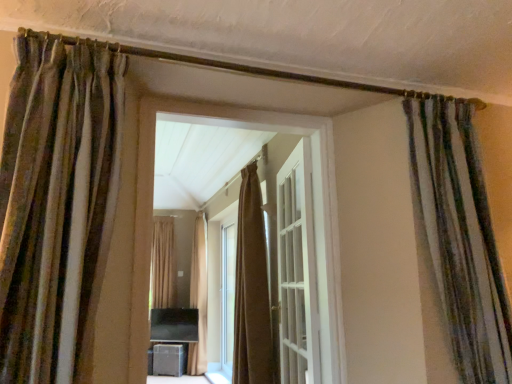
The image size is (512, 384). Describe the element at coordinates (56, 205) in the screenshot. I see `brown textured curtain at left, the fifth curtain positioned from the back` at that location.

Measure the distance between beige fabric curtain at center, which is counted as the 2th curtain, starting from the back, and camera.

The distance of beige fabric curtain at center, which is counted as the 2th curtain, starting from the back, from camera is 5.66 meters.

Where is `brown curtain at center`? Image resolution: width=512 pixels, height=384 pixels. brown curtain at center is located at coordinates (315, 208).

The image size is (512, 384). Describe the element at coordinates (315, 208) in the screenshot. I see `brown curtain at center` at that location.

The image size is (512, 384). I want to click on brown textured curtain at left, which is the third curtain in right-to-left order, so click(x=56, y=205).

Consider the image. Considering the relative sizes of brown textured curtain at center, which appears as the first curtain when viewed from the back, and brown textured curtain at left, the fifth curtain positioned from the back, in the image provided, is brown textured curtain at center, which appears as the first curtain when viewed from the back, shorter than brown textured curtain at left, the fifth curtain positioned from the back,?

No.

From the image's perspective, between brown textured curtain at center, marked as the first curtain in a left-to-right arrangement, and brown textured curtain at left, acting as the 3th curtain starting from the left, who is located below?

brown textured curtain at center, marked as the first curtain in a left-to-right arrangement, appears lower in the image.

Could you measure the distance between brown textured curtain at center, placed as the fifth curtain when sorted from front to back, and brown textured curtain at left, which is the third curtain in right-to-left order?

brown textured curtain at center, placed as the fifth curtain when sorted from front to back, is 5.22 meters from brown textured curtain at left, which is the third curtain in right-to-left order.

Is brown textured curtain at left, the fifth curtain positioned from the back, at the back of brown textured curtain at center, which appears as the first curtain when viewed from the back?

That's not correct — brown textured curtain at center, which appears as the first curtain when viewed from the back, is not looking away from brown textured curtain at left, the fifth curtain positioned from the back.

Considering the sizes of objects striped fabric curtain at right, the 4th curtain when ordered from back to front, and brown textured curtain at left, which is the third curtain in right-to-left order, in the image provided, who is wider, striped fabric curtain at right, the 4th curtain when ordered from back to front, or brown textured curtain at left, which is the third curtain in right-to-left order,?

brown textured curtain at left, which is the third curtain in right-to-left order, is wider.

Could brown textured curtain at left, which is the third curtain in right-to-left order, be considered to be inside striped fabric curtain at right, the 4th curtain when ordered from back to front?

No.

Looking at this image, how many degrees apart are the facing directions of striped fabric curtain at right, the 4th curtain when ordered from back to front, and brown textured curtain at left, acting as the 3th curtain starting from the left?

0 degrees separate the facing orientations of striped fabric curtain at right, the 4th curtain when ordered from back to front, and brown textured curtain at left, acting as the 3th curtain starting from the left.

From their relative heights in the image, would you say striped fabric curtain at right, the 4th curtain when ordered from back to front, is taller or shorter than brown textured curtain at left, which is the third curtain in right-to-left order?

In the image, striped fabric curtain at right, the 4th curtain when ordered from back to front, appears to be taller than brown textured curtain at left, which is the third curtain in right-to-left order.

From a real-world perspective, is white glossy door at center physically located above or below brown textured curtain at left, which is the third curtain in right-to-left order?

Clearly, from a real-world perspective, white glossy door at center is below brown textured curtain at left, which is the third curtain in right-to-left order.

Between white glossy door at center and brown textured curtain at left, the fifth curtain positioned from the back, which one has larger size?

white glossy door at center.

Is white glossy door at center not close to brown textured curtain at left, the fifth curtain positioned from the back?

white glossy door at center is positioned a significant distance from brown textured curtain at left, the fifth curtain positioned from the back.

Can you confirm if white glossy door at center is thinner than beige fabric curtain at center, which is counted as the 2th curtain, starting from the back?

Indeed, white glossy door at center has a lesser width compared to beige fabric curtain at center, which is counted as the 2th curtain, starting from the back.

Which object is closer to the camera taking this photo, white glossy door at center or beige fabric curtain at center, which ranks as the second curtain in left-to-right order?

white glossy door at center is closer to the camera.

Would you say white glossy door at center contains beige fabric curtain at center, which is counted as the 4th curtain, starting from the right?

No, beige fabric curtain at center, which is counted as the 4th curtain, starting from the right, is not inside white glossy door at center.

Is white glossy door at center beside beige fabric curtain at center, the 4th curtain from the front?

No, white glossy door at center is not with beige fabric curtain at center, the 4th curtain from the front.

Who is shorter, striped fabric curtain at right, which ranks as the 2th curtain in front-to-back order, or beige fabric curtain at center, which is counted as the 2th curtain, starting from the back?

striped fabric curtain at right, which ranks as the 2th curtain in front-to-back order.

Can you confirm if striped fabric curtain at right, which ranks as the 1th curtain in right-to-left order, is smaller than beige fabric curtain at center, the 4th curtain from the front?

Indeed, striped fabric curtain at right, which ranks as the 1th curtain in right-to-left order, has a smaller size compared to beige fabric curtain at center, the 4th curtain from the front.

Would you say beige fabric curtain at center, the 4th curtain from the front, is part of striped fabric curtain at right, positioned as the 5th curtain in left-to-right order,'s contents?

No, beige fabric curtain at center, the 4th curtain from the front, is not surrounded by striped fabric curtain at right, positioned as the 5th curtain in left-to-right order.

Is striped fabric curtain at right, which ranks as the 2th curtain in front-to-back order, not close to beige fabric curtain at center, which is counted as the 2th curtain, starting from the back?

striped fabric curtain at right, which ranks as the 2th curtain in front-to-back order, is far away from beige fabric curtain at center, which is counted as the 2th curtain, starting from the back.

Could you tell me if brown curtain at center is turned towards brown textured curtain at left, acting as the 3th curtain starting from the left?

No, brown curtain at center is not turned towards brown textured curtain at left, acting as the 3th curtain starting from the left.

Which point is more forward, (137,365) or (50,207)?

The point (50,207) is in front.

Who is shorter, brown curtain at center or brown textured curtain at left, positioned as the 1th curtain in front-to-back order?

brown textured curtain at left, positioned as the 1th curtain in front-to-back order.

Is brown curtain at center completely or partially outside of brown textured curtain at left, the fifth curtain positioned from the back?

Absolutely, brown curtain at center is external to brown textured curtain at left, the fifth curtain positioned from the back.

What's the angular difference between brown textured curtain at center, marked as the first curtain in a left-to-right arrangement, and brown velvet curtain at center, the 3th curtain viewed from the front,'s facing directions?

The angle between the facing direction of brown textured curtain at center, marked as the first curtain in a left-to-right arrangement, and the facing direction of brown velvet curtain at center, the 3th curtain viewed from the front, is 92.4 degrees.

Looking at this image, would you say brown velvet curtain at center, which is the 4th curtain from left to right, is part of brown textured curtain at center, placed as the fifth curtain when sorted from front to back,'s contents?

That's incorrect, brown velvet curtain at center, which is the 4th curtain from left to right, is not inside brown textured curtain at center, placed as the fifth curtain when sorted from front to back.

In terms of width, does brown textured curtain at center, the 5th curtain from the right, look wider or thinner when compared to brown velvet curtain at center, which is the 2th curtain from right to left?

In the image, brown textured curtain at center, the 5th curtain from the right, appears to be more narrow than brown velvet curtain at center, which is the 2th curtain from right to left.

How distant is brown textured curtain at center, which appears as the first curtain when viewed from the back, from brown velvet curtain at center, which is the 2th curtain from right to left?

They are 3.32 meters apart.

Where is `the 3rd curtain below the brown textured curtain at left, positioned as the 1th curtain in front-to-back order (from the image's perspective)`? the 3rd curtain below the brown textured curtain at left, positioned as the 1th curtain in front-to-back order (from the image's perspective) is located at coordinates (162, 263).

From a real-world perspective, starting from the brown textured curtain at left, the fifth curtain positioned from the back, which curtain is the 1st one below it? Please provide its 2D coordinates.

[(460, 235)]

When comparing their distances from striped fabric curtain at right, the 4th curtain when ordered from back to front, does white glossy door at center or beige fabric curtain at center, which ranks as the second curtain in left-to-right order, seem closer?

Among the two, white glossy door at center is located nearer to striped fabric curtain at right, the 4th curtain when ordered from back to front.

Based on their spatial positions, is brown textured curtain at left, the fifth curtain positioned from the back, or brown textured curtain at center, the 5th curtain from the right, closer to matte black speaker at lower center?

brown textured curtain at center, the 5th curtain from the right, is closer to matte black speaker at lower center.

Based on their spatial positions, is beige fabric curtain at center, which ranks as the second curtain in left-to-right order, or white glossy door at center further from matte black speaker at lower center?

The object further to matte black speaker at lower center is white glossy door at center.

Which object lies nearer to the anchor point brown textured curtain at left, acting as the 3th curtain starting from the left, white glossy door at center or brown textured curtain at center, the 5th curtain from the right?

The object closer to brown textured curtain at left, acting as the 3th curtain starting from the left, is white glossy door at center.

Looking at the image, which one is located closer to brown textured curtain at left, the fifth curtain positioned from the back, brown curtain at center or brown velvet curtain at center, which is the 2th curtain from right to left?

brown curtain at center.

From the image, which object appears to be nearer to white glossy door at center, brown textured curtain at left, positioned as the 1th curtain in front-to-back order, or brown velvet curtain at center, the 3th curtain viewed from the front?

Based on the image, brown velvet curtain at center, the 3th curtain viewed from the front, appears to be nearer to white glossy door at center.

Considering their positions, is beige fabric curtain at center, which is counted as the 2th curtain, starting from the back, positioned closer to brown curtain at center than brown textured curtain at left, positioned as the 1th curtain in front-to-back order?

brown textured curtain at left, positioned as the 1th curtain in front-to-back order.

When comparing their distances from white glossy door at center, does brown velvet curtain at center, which is the 2th curtain from right to left, or brown textured curtain at left, positioned as the 1th curtain in front-to-back order, seem further?

brown textured curtain at left, positioned as the 1th curtain in front-to-back order, is further to white glossy door at center.

You are a GUI agent. You are given a task and a screenshot of the screen. Output one action in this format:
    pyautogui.click(x=<x>, y=<y>)
    Task: Click on the door positioned between brown textured curtain at left, positioned as the 1th curtain in front-to-back order, and beige fabric curtain at center, the 4th curtain from the front, from near to far
    
    Given the screenshot: What is the action you would take?
    pyautogui.click(x=297, y=270)

Where is `door between brown textured curtain at left, positioned as the 1th curtain in front-to-back order, and brown textured curtain at center, marked as the first curtain in a left-to-right arrangement, from front to back`? Image resolution: width=512 pixels, height=384 pixels. door between brown textured curtain at left, positioned as the 1th curtain in front-to-back order, and brown textured curtain at center, marked as the first curtain in a left-to-right arrangement, from front to back is located at coordinates (297, 270).

Identify the location of door located between brown textured curtain at left, the fifth curtain positioned from the back, and brown velvet curtain at center, which is the 2th curtain from right to left, in the depth direction. (297, 270).

Where is `furniture between brown textured curtain at left, which is the third curtain in right-to-left order, and brown textured curtain at center, marked as the first curtain in a left-to-right arrangement, along the z-axis`? furniture between brown textured curtain at left, which is the third curtain in right-to-left order, and brown textured curtain at center, marked as the first curtain in a left-to-right arrangement, along the z-axis is located at coordinates (169, 359).